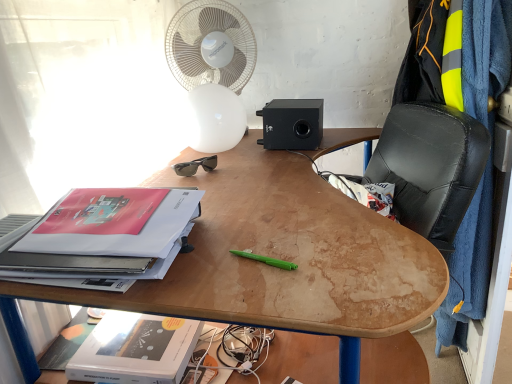
The width and height of the screenshot is (512, 384). Find the location of `vacant area that is situated to the right of black plastic speaker at upper center`. vacant area that is situated to the right of black plastic speaker at upper center is located at coordinates (348, 129).